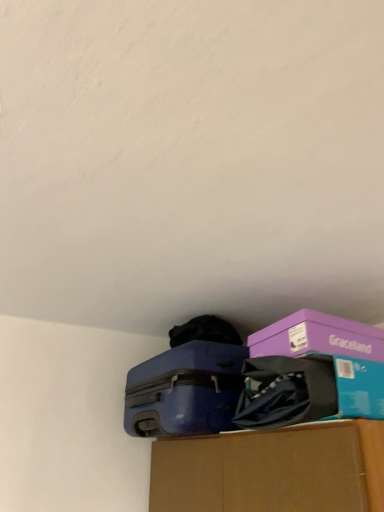
Question: Can matte blue suitcase at center be found inside matte purple storage box at center?

Choices:
 (A) no
 (B) yes

Answer: (A)

Question: Can you confirm if matte purple storage box at center is smaller than matte blue suitcase at center?

Choices:
 (A) no
 (B) yes

Answer: (B)

Question: From the image's perspective, is matte purple storage box at center located beneath matte blue suitcase at center?

Choices:
 (A) yes
 (B) no

Answer: (B)

Question: From a real-world perspective, is matte purple storage box at center over matte blue suitcase at center?

Choices:
 (A) yes
 (B) no

Answer: (B)

Question: From the image's perspective, is matte purple storage box at center over matte blue suitcase at center?

Choices:
 (A) yes
 (B) no

Answer: (A)

Question: Considering the relative sizes of matte purple storage box at center and matte blue suitcase at center in the image provided, is matte purple storage box at center shorter than matte blue suitcase at center?

Choices:
 (A) yes
 (B) no

Answer: (A)

Question: Is purple cardboard box at upper right thinner than matte purple storage box at center?

Choices:
 (A) yes
 (B) no

Answer: (A)

Question: From the image's perspective, does purple cardboard box at upper right appear lower than matte purple storage box at center?

Choices:
 (A) no
 (B) yes

Answer: (A)

Question: From a real-world perspective, is purple cardboard box at upper right physically below matte purple storage box at center?

Choices:
 (A) yes
 (B) no

Answer: (B)

Question: Is purple cardboard box at upper right turned away from matte purple storage box at center?

Choices:
 (A) yes
 (B) no

Answer: (B)

Question: Considering the relative sizes of purple cardboard box at upper right and matte purple storage box at center in the image provided, is purple cardboard box at upper right bigger than matte purple storage box at center?

Choices:
 (A) no
 (B) yes

Answer: (A)

Question: Is purple cardboard box at upper right positioned beyond the bounds of matte purple storage box at center?

Choices:
 (A) no
 (B) yes

Answer: (B)

Question: Is matte blue suitcase at center wider than matte purple storage box at center?

Choices:
 (A) no
 (B) yes

Answer: (B)